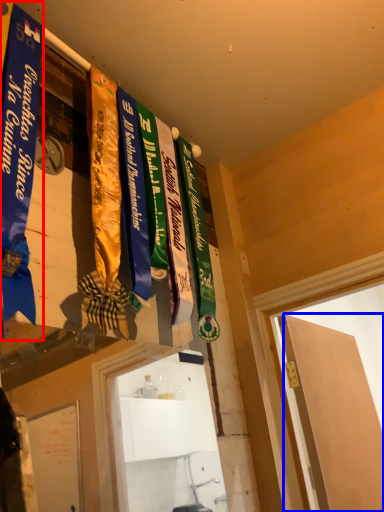
Question: Which object is closer to the camera taking this photo, banner (highlighted by a red box) or door (highlighted by a blue box)?

Choices:
 (A) banner
 (B) door

Answer: (A)